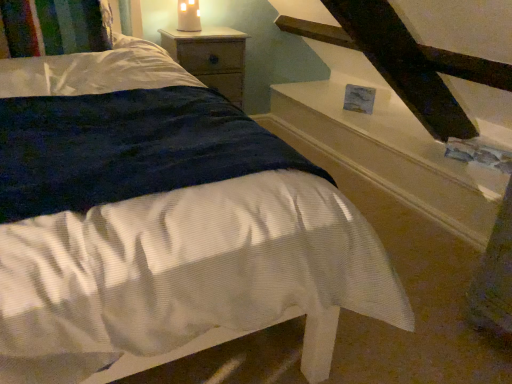
Question: Is matte white candle at upper center taller than multicolored knitted pillow at upper left?

Choices:
 (A) no
 (B) yes

Answer: (B)

Question: Is matte white candle at upper center oriented towards multicolored knitted pillow at upper left?

Choices:
 (A) no
 (B) yes

Answer: (A)

Question: Is matte white candle at upper center completely or partially outside of multicolored knitted pillow at upper left?

Choices:
 (A) no
 (B) yes

Answer: (B)

Question: From a real-world perspective, is matte white candle at upper center located beneath multicolored knitted pillow at upper left?

Choices:
 (A) no
 (B) yes

Answer: (A)

Question: Considering the relative sizes of matte white candle at upper center and multicolored knitted pillow at upper left in the image provided, is matte white candle at upper center thinner than multicolored knitted pillow at upper left?

Choices:
 (A) no
 (B) yes

Answer: (B)

Question: From the image's perspective, is matte white candle at upper center on multicolored knitted pillow at upper left?

Choices:
 (A) yes
 (B) no

Answer: (A)

Question: Is white glossy stairwell at upper right not near multicolored knitted pillow at upper left?

Choices:
 (A) no
 (B) yes

Answer: (B)

Question: Is the depth of white glossy stairwell at upper right greater than that of multicolored knitted pillow at upper left?

Choices:
 (A) no
 (B) yes

Answer: (B)

Question: Is white glossy stairwell at upper right next to multicolored knitted pillow at upper left and touching it?

Choices:
 (A) no
 (B) yes

Answer: (A)

Question: Is white glossy stairwell at upper right located outside multicolored knitted pillow at upper left?

Choices:
 (A) yes
 (B) no

Answer: (A)

Question: Does white glossy stairwell at upper right have a smaller size compared to multicolored knitted pillow at upper left?

Choices:
 (A) no
 (B) yes

Answer: (A)

Question: From the image's perspective, does white glossy stairwell at upper right appear lower than multicolored knitted pillow at upper left?

Choices:
 (A) yes
 (B) no

Answer: (A)

Question: From a real-world perspective, is multicolored knitted pillow at upper left physically above wooden nightstand at upper center?

Choices:
 (A) no
 (B) yes

Answer: (B)